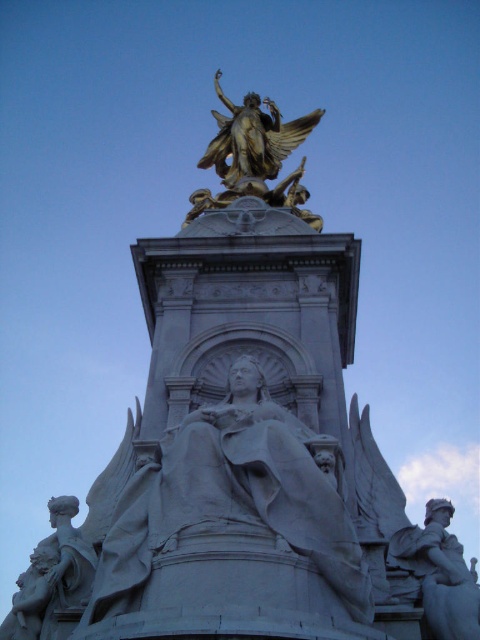
Question: Which of the following is the farthest from the observer?

Choices:
 (A) pyautogui.click(x=60, y=563)
 (B) pyautogui.click(x=278, y=147)
 (C) pyautogui.click(x=412, y=529)

Answer: (B)

Question: Does white marble statue at lower right appear on the right side of white marble statue at lower left?

Choices:
 (A) yes
 (B) no

Answer: (A)

Question: Which point is farther to the camera?

Choices:
 (A) gold/gilded statue at upper center
 (B) white marble statue at lower right

Answer: (A)

Question: Does gold/gilded statue at upper center have a smaller size compared to white marble statue at lower left?

Choices:
 (A) yes
 (B) no

Answer: (B)

Question: In this image, where is gold/gilded statue at upper center located relative to white marble statue at lower left?

Choices:
 (A) right
 (B) left

Answer: (A)

Question: Which object is farther from the camera taking this photo?

Choices:
 (A) gold/gilded statue at upper center
 (B) white marble statue at lower left
 (C) white marble statue at lower right

Answer: (A)